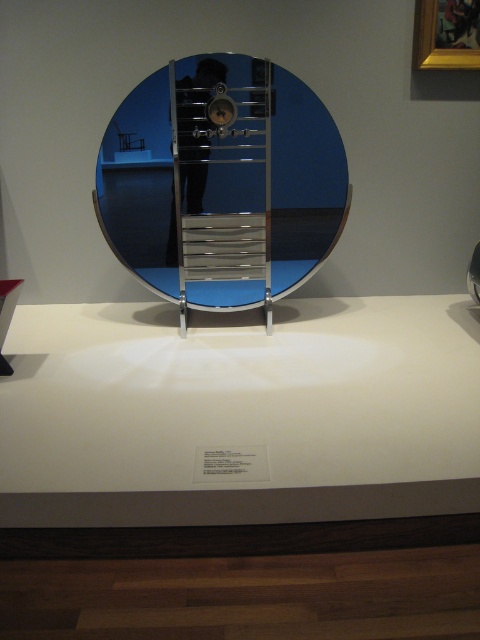
Question: Which object is the closest to the metallic silver clock at center?

Choices:
 (A) polished chrome ladder at center
 (B) polished chrome mirror at center

Answer: (A)

Question: Can you confirm if polished chrome mirror at center is thinner than metallic silver clock at center?

Choices:
 (A) yes
 (B) no

Answer: (B)

Question: Among these objects, which one is nearest to the camera?

Choices:
 (A) white glossy counter top at center
 (B) polished chrome ladder at center
 (C) polished chrome mirror at center
 (D) metallic silver clock at center

Answer: (A)

Question: Considering the relative positions of white glossy counter top at center and polished chrome mirror at center in the image provided, where is white glossy counter top at center located with respect to polished chrome mirror at center?

Choices:
 (A) left
 (B) right

Answer: (B)

Question: Estimate the real-world distances between objects in this image. Which object is farther from the polished chrome ladder at center?

Choices:
 (A) polished chrome mirror at center
 (B) metallic silver clock at center
 (C) white glossy counter top at center

Answer: (C)

Question: Does polished chrome mirror at center have a greater width compared to polished chrome ladder at center?

Choices:
 (A) no
 (B) yes

Answer: (B)